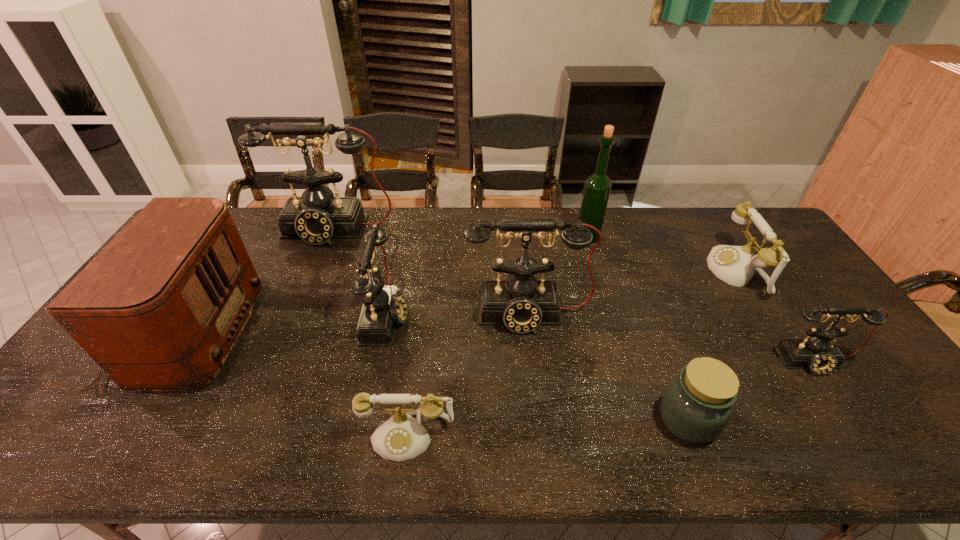
In the image, there is a desktop. Where is `vacant space at the near edge`? vacant space at the near edge is located at coordinates (492, 426).

The width and height of the screenshot is (960, 540). Find the location of `vacant area at the far right corner`. vacant area at the far right corner is located at coordinates (742, 234).

This screenshot has height=540, width=960. What are the coordinates of `free spot between the smallest black telephone and the nearest telephone` in the screenshot? It's located at (612, 399).

Locate an element on the screen. The width and height of the screenshot is (960, 540). vacant region between the jar and the brown radio receiver is located at coordinates 438,376.

Locate an element on the screen. free space between the right white telephone and the liquor is located at coordinates (661, 254).

The image size is (960, 540). What are the coordinates of `free point between the liquor and the smallest black telephone` in the screenshot? It's located at (701, 299).

Locate an element on the screen. The width and height of the screenshot is (960, 540). vacant point located between the second black telephone from right to left and the rightmost black telephone is located at coordinates (672, 338).

You are a GUI agent. You are given a task and a screenshot of the screen. Output one action in this format:
    pyautogui.click(x=<x>, y=<y>)
    Task: Click on the free point between the liquor and the rightmost black telephone
    
    Given the screenshot: What is the action you would take?
    pyautogui.click(x=701, y=299)

You are a GUI agent. You are given a task and a screenshot of the screen. Output one action in this format:
    pyautogui.click(x=<x>, y=<y>)
    Task: Click on the free space between the liquor and the fourth shortest telephone
    
    Given the screenshot: What is the action you would take?
    [x=487, y=275]

You are a GUI agent. You are given a task and a screenshot of the screen. Output one action in this format:
    pyautogui.click(x=<x>, y=<y>)
    Task: Click on the free point between the third biggest black telephone and the rightmost black telephone
    
    Given the screenshot: What is the action you would take?
    pyautogui.click(x=601, y=338)